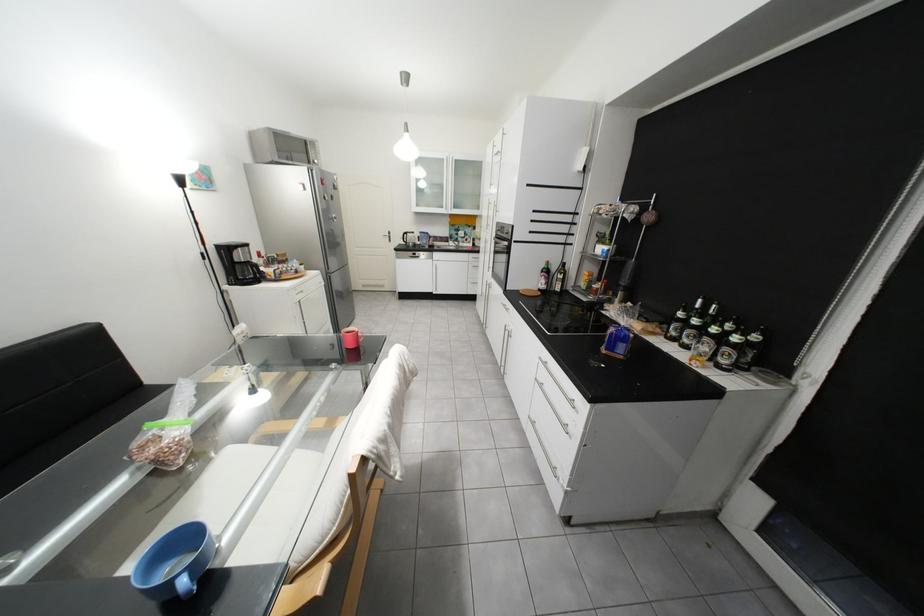
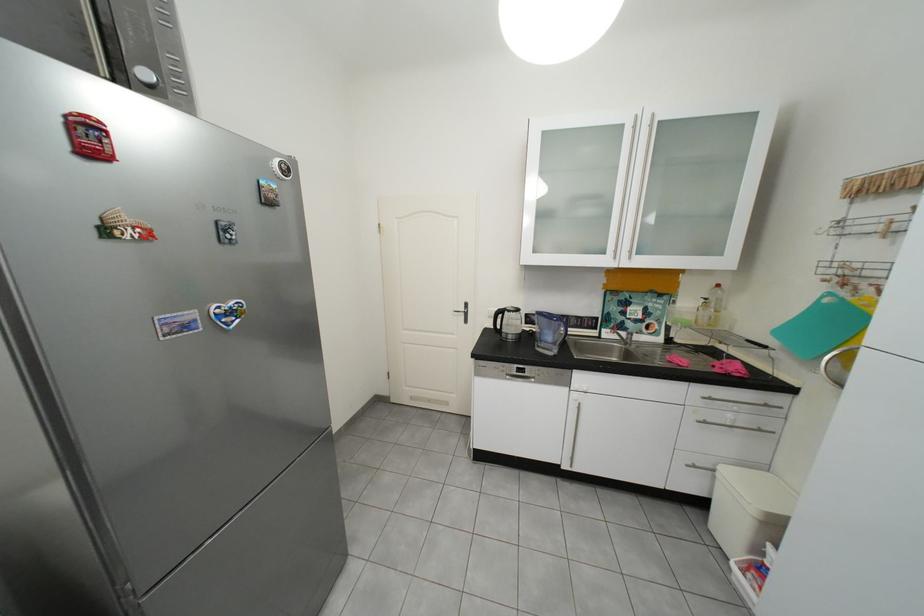
The point at (x=436, y=243) is marked in the first image. Where is the corresponding point in the second image?

(561, 339)